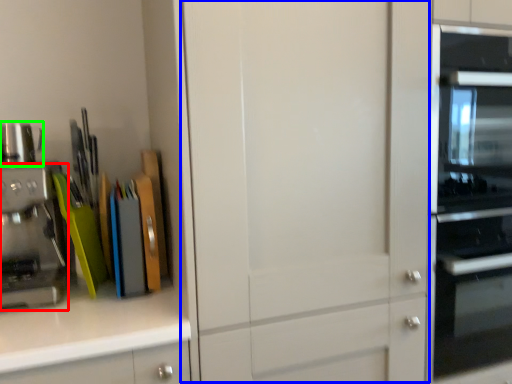
Question: Which object is positioned closest to kitchen appliance (highlighted by a red box)? Select from glass door (highlighted by a blue box) and appliance (highlighted by a green box).

Choices:
 (A) glass door
 (B) appliance

Answer: (B)